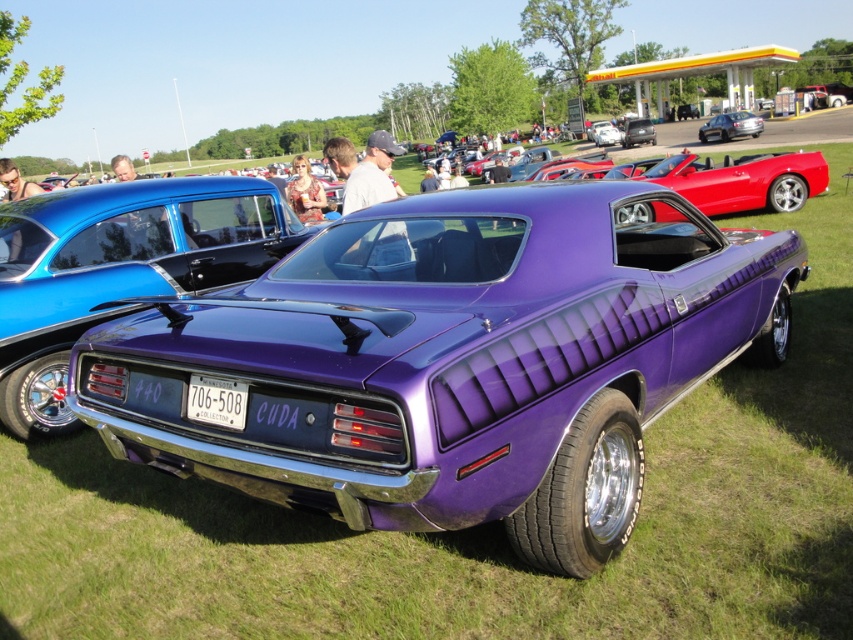
Can you confirm if metallic purple muscle car at center is shorter than metallic silver sedan at center?

Indeed, metallic purple muscle car at center has a lesser height compared to metallic silver sedan at center.

Between metallic purple muscle car at center and metallic silver sedan at center, which one is positioned lower?

metallic purple muscle car at center

Measure the distance between point (634,477) and camera.

3.19 meters

The image size is (853, 640). I want to click on metallic purple muscle car at center, so click(454, 362).

Who is lower down, white plastic license plate at center or metallic silver sedan at center?

white plastic license plate at center

Is white plastic license plate at center bigger than metallic silver sedan at center?

Actually, white plastic license plate at center might be smaller than metallic silver sedan at center.

Image resolution: width=853 pixels, height=640 pixels. What do you see at coordinates (216, 401) in the screenshot? I see `white plastic license plate at center` at bounding box center [216, 401].

I want to click on white plastic license plate at center, so click(216, 401).

Is metallic blue sedan at center smaller than metallic silver sedan at center?

Correct, metallic blue sedan at center occupies less space than metallic silver sedan at center.

I want to click on metallic blue sedan at center, so click(117, 269).